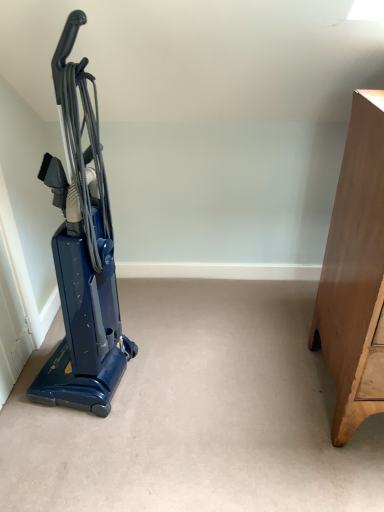
The image size is (384, 512). I want to click on vacant space to the right of blue glossy vacuum cleaner at left, so (x=172, y=380).